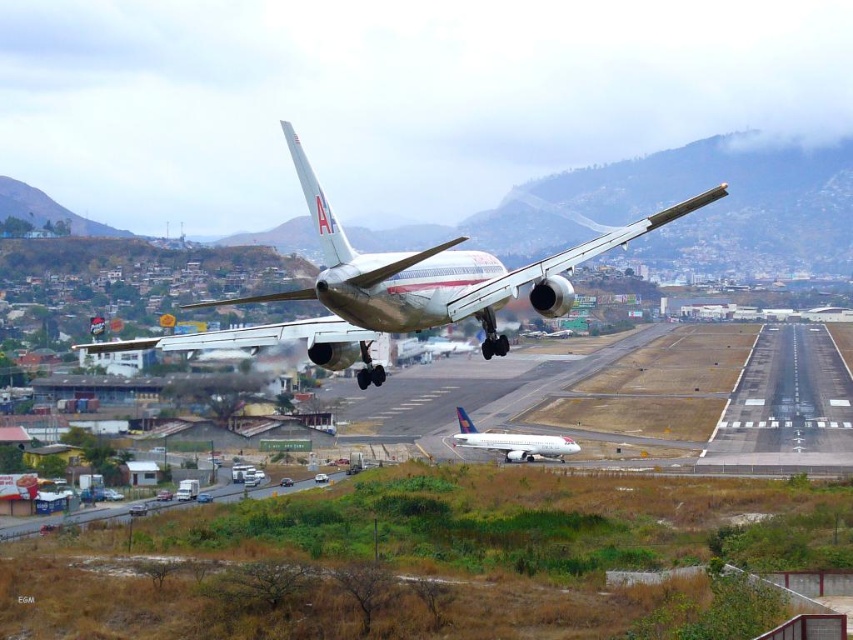
Where is `smooth asphalt runway at center`? smooth asphalt runway at center is located at coordinates (786, 403).

The width and height of the screenshot is (853, 640). What do you see at coordinates (786, 403) in the screenshot? I see `smooth asphalt runway at center` at bounding box center [786, 403].

Find the location of `smooth asphalt runway at center`. smooth asphalt runway at center is located at coordinates (786, 403).

Is the position of metallic silver airplane at center less distant than that of white glossy airplane at center?

Yes, it is.

Between point (540, 273) and point (573, 445), which one is positioned behind?

The point (573, 445) is behind.

Identify the location of metallic silver airplane at center. The width and height of the screenshot is (853, 640). (399, 289).

Does point (380, 275) lie behind point (805, 342)?

No, (380, 275) is closer to viewer.

Who is higher up, metallic silver airplane at center or smooth asphalt runway at center?

metallic silver airplane at center is above.

Image resolution: width=853 pixels, height=640 pixels. What are the coordinates of `metallic silver airplane at center` in the screenshot? It's located at (399, 289).